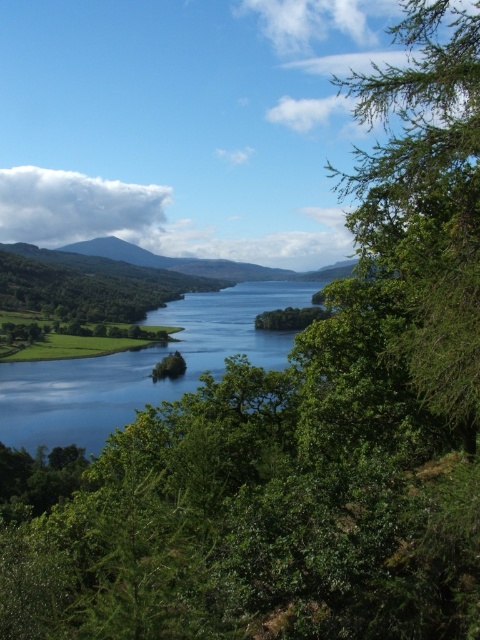
Who is taller, green needle-like leaves at right or green grassy water at center?

Standing taller between the two is green needle-like leaves at right.

Who is more distant from viewer, (418,259) or (95,426)?

The point (95,426) is behind.

What do you see at coordinates (427, 200) in the screenshot? The image size is (480, 640). I see `green needle-like leaves at right` at bounding box center [427, 200].

The height and width of the screenshot is (640, 480). I want to click on green needle-like leaves at right, so click(x=427, y=200).